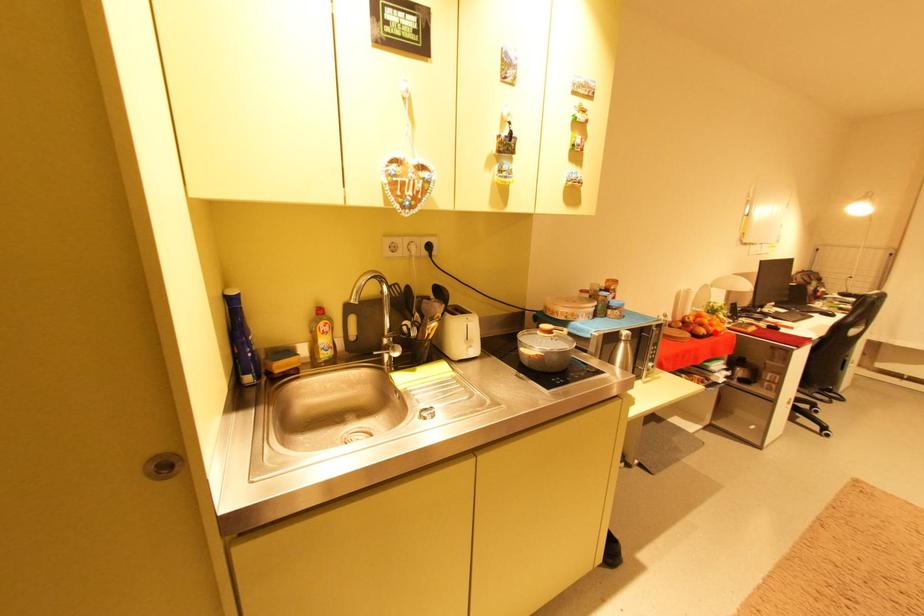
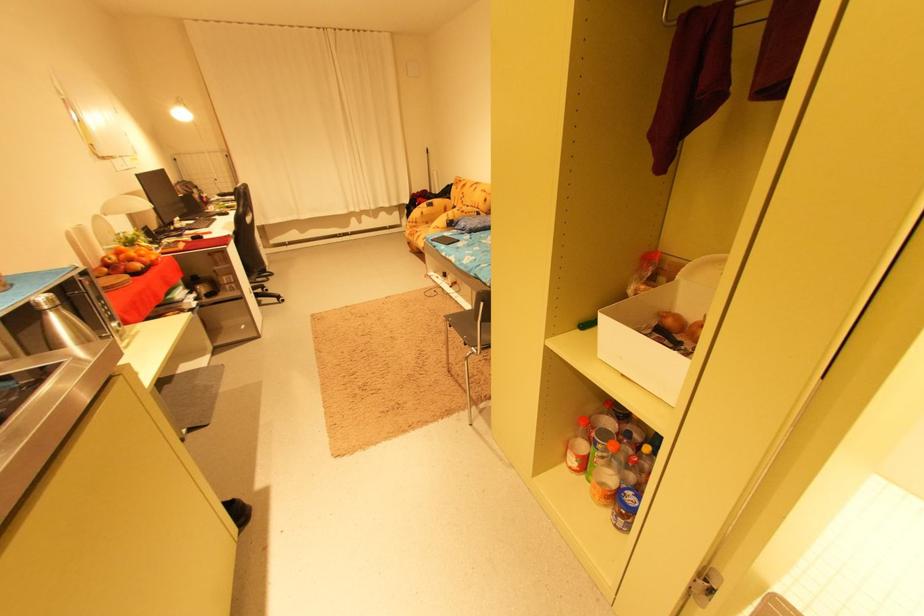
Where in the second image is the point corresponding to the highlighted location from the first image?

(151, 265)